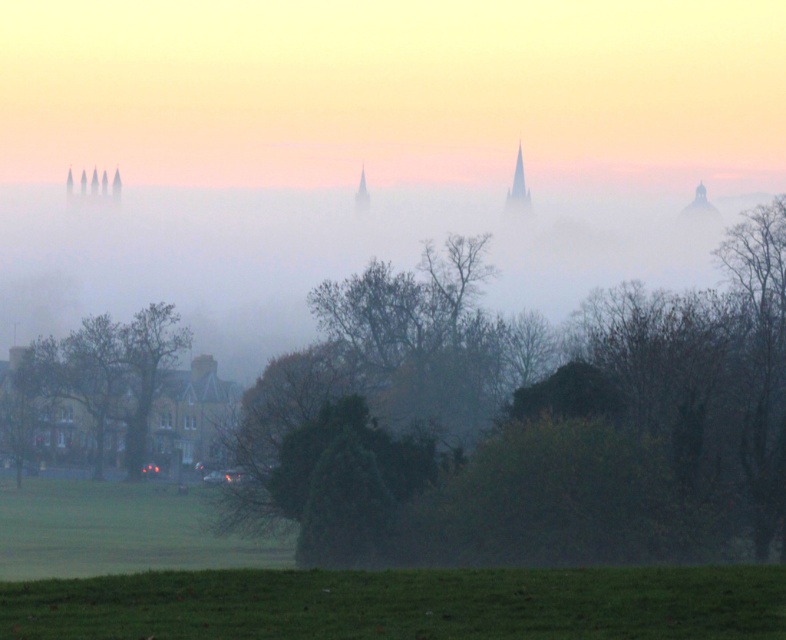
Does foggy misty atmosphere at center have a smaller size compared to green matte tree at lower left?

No, foggy misty atmosphere at center is not smaller than green matte tree at lower left.

Is foggy misty atmosphere at center positioned behind green matte tree at lower left?

Yes, it is behind green matte tree at lower left.

Image resolution: width=786 pixels, height=640 pixels. What do you see at coordinates (324, 253) in the screenshot? I see `foggy misty atmosphere at center` at bounding box center [324, 253].

You are a GUI agent. You are given a task and a screenshot of the screen. Output one action in this format:
    pyautogui.click(x=<x>, y=<y>)
    Task: Click on the foggy misty atmosphere at center
    
    Given the screenshot: What is the action you would take?
    pyautogui.click(x=324, y=253)

Can you confirm if smokey gray spire at upper center is positioned to the left of smooth stone spire at center?

In fact, smokey gray spire at upper center is to the right of smooth stone spire at center.

Can you confirm if smokey gray spire at upper center is positioned to the right of smooth stone spire at center?

Correct, you'll find smokey gray spire at upper center to the right of smooth stone spire at center.

Between point (520, 145) and point (360, 192), which one is positioned behind?

Point (520, 145)

Identify the location of smokey gray spire at upper center. (518, 188).

Who is shorter, foggy misty atmosphere at center or smooth stone spire at center?

Standing shorter between the two is smooth stone spire at center.

Is point (403, 204) farther from camera compared to point (358, 189)?

Yes, it is behind point (358, 189).

Image resolution: width=786 pixels, height=640 pixels. I want to click on foggy misty atmosphere at center, so click(x=324, y=253).